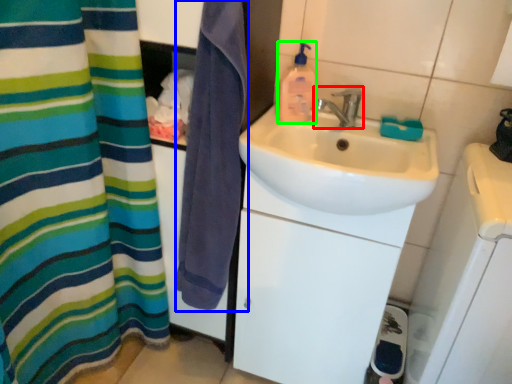
Question: Considering the real-world distances, which object is farthest from tap (highlighted by a red box)? beach towel (highlighted by a blue box) or cleaning product (highlighted by a green box)?

Choices:
 (A) beach towel
 (B) cleaning product

Answer: (A)